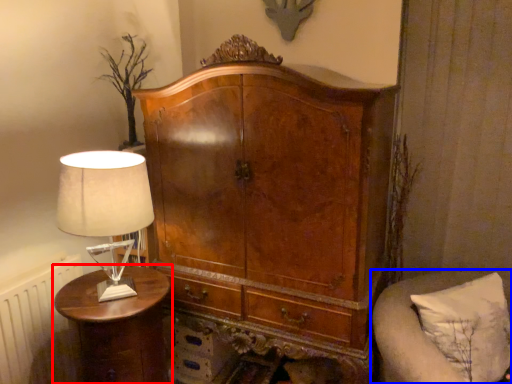
Question: Which object appears farthest to the camera in this image, nightstand (highlighted by a red box) or furniture (highlighted by a blue box)?

Choices:
 (A) nightstand
 (B) furniture

Answer: (A)